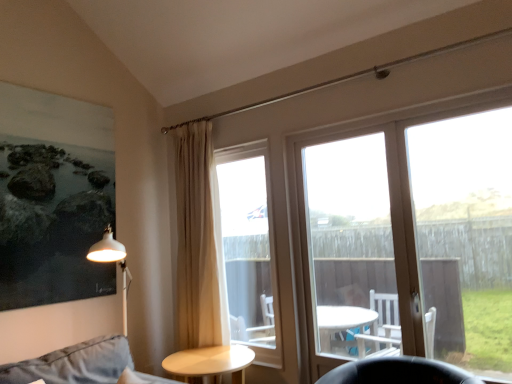
Identify the location of transparent glass door at upper right. Image resolution: width=512 pixels, height=384 pixels. (403, 226).

Locate an element on the screen. clear glass door at center is located at coordinates (250, 249).

The image size is (512, 384). What do you see at coordinates (210, 363) in the screenshot? I see `light beige wooden table at center` at bounding box center [210, 363].

In order to face light beige wooden table at center, should I rotate leftwards or rightwards?

Turn left approximately 6.243 degrees to face it.

The image size is (512, 384). Find the location of `beige fabric curtain at center`. beige fabric curtain at center is located at coordinates (198, 241).

Considering the relative sizes of white glass door at center and clear glass door at center right in the image provided, is white glass door at center thinner than clear glass door at center right?

Yes.

Between white glass door at center and clear glass door at center right, which one appears on the right side from the viewer's perspective?

clear glass door at center right.

From a real-world perspective, is white glass door at center below clear glass door at center right?

Correct, in the physical world, white glass door at center is lower than clear glass door at center right.

Is beige fabric curtain at center a part of clear glass door at center?

No, beige fabric curtain at center is located outside of clear glass door at center.

Would you consider clear glass door at center to be distant from beige fabric curtain at center?

clear glass door at center is near beige fabric curtain at center, not far away.

Visually, is clear glass door at center positioned to the left or to the right of beige fabric curtain at center?

Based on their positions, clear glass door at center is located to the right of beige fabric curtain at center.

Considering the positions of point (261, 220) and point (177, 134), is point (261, 220) closer or farther from the camera than point (177, 134)?

Clearly, point (261, 220) is more distant from the camera than point (177, 134).

Would you consider beige fabric curtain at center to be distant from white glass door at center?

beige fabric curtain at center is actually quite close to white glass door at center.

Between beige fabric curtain at center and white glass door at center, which one is positioned in front?

Positioned in front is white glass door at center.

Is beige fabric curtain at center aimed at white glass door at center?

No, beige fabric curtain at center is not oriented towards white glass door at center.

Is light beige wooden table at center turned away from beige fabric curtain at center?

No, light beige wooden table at center is not facing away from beige fabric curtain at center.

The image size is (512, 384). What are the coordinates of `table on the right of beige fabric curtain at center` in the screenshot? It's located at (210, 363).

Are light beige wooden table at center and beige fabric curtain at center making contact?

No.

How different are the orientations of light beige wooden table at center and clear glass door at center in degrees?

light beige wooden table at center and clear glass door at center are facing 91.7 degrees away from each other.

Which is nearer, (x=201, y=372) or (x=247, y=328)?

The point (x=201, y=372) is in front.

Would you say light beige wooden table at center is a long distance from clear glass door at center?

No, light beige wooden table at center is not far from clear glass door at center.

Can you tell me how much clear glass door at center right and clear glass door at center differ in facing direction?

0.000288 degrees separate the facing orientations of clear glass door at center right and clear glass door at center.

From a real-world perspective, is clear glass door at center right physically below clear glass door at center?

No, from a real-world perspective, clear glass door at center right is not below clear glass door at center.

Is clear glass door at center right far away from clear glass door at center?

Absolutely, clear glass door at center right is distant from clear glass door at center.

Is clear glass door at center right at the right side of clear glass door at center?

Yes, clear glass door at center right is to the right of clear glass door at center.

Is white glass door at center spatially inside beige fabric curtain at center, or outside of it?

white glass door at center lies outside beige fabric curtain at center.

Consider the image. Considering the sizes of objects white glass door at center and beige fabric curtain at center in the image provided, who is smaller, white glass door at center or beige fabric curtain at center?

With smaller size is white glass door at center.

From the image's perspective, is white glass door at center located beneath beige fabric curtain at center?

Indeed, from the image's perspective, white glass door at center is shown beneath beige fabric curtain at center.

Considering the positions of objects white glass door at center and beige fabric curtain at center in the image provided, who is behind, white glass door at center or beige fabric curtain at center?

Positioned behind is beige fabric curtain at center.

Where is `screen door that is on the left side of clear glass door at center right`? This screenshot has height=384, width=512. screen door that is on the left side of clear glass door at center right is located at coordinates pos(356,250).

Where is `curtain above the clear glass door at center (from a real-world perspective)`? curtain above the clear glass door at center (from a real-world perspective) is located at coordinates (198, 241).

Based on their spatial positions, is clear glass door at center or light beige wooden table at center further from clear glass door at center right?

light beige wooden table at center is further to clear glass door at center right.

Considering their positions, is clear glass door at center positioned closer to white glass door at center than beige fabric curtain at center?

clear glass door at center lies closer to white glass door at center than the other object.

When comparing their distances from transparent glass door at upper right, does beige fabric curtain at center or clear glass door at center right seem closer?

clear glass door at center right is closer to transparent glass door at upper right.

From the picture: Considering their positions, is white glass door at center positioned further to beige fabric curtain at center than clear glass door at center?

Based on the image, white glass door at center appears to be further to beige fabric curtain at center.

When comparing their distances from transparent glass door at upper right, does light beige wooden table at center or clear glass door at center seem further?

light beige wooden table at center.

Estimate the real-world distances between objects in this image. Which object is further from clear glass door at center right, transparent glass door at upper right or light beige wooden table at center?

light beige wooden table at center is further to clear glass door at center right.

Consider the image. When comparing their distances from transparent glass door at upper right, does white glass door at center or clear glass door at center seem closer?

white glass door at center.

Estimate the real-world distances between objects in this image. Which object is further from beige fabric curtain at center, transparent glass door at upper right or clear glass door at center right?

clear glass door at center right is further to beige fabric curtain at center.

Find the location of a particular element. window between light beige wooden table at center and clear glass door at center right in the horizontal direction is located at coordinates (403, 226).

You are a GUI agent. You are given a task and a screenshot of the screen. Output one action in this format:
    pyautogui.click(x=<x>, y=<y>)
    Task: Click on the window located between white glass door at center and clear glass door at center right in the left-right direction
    Image resolution: width=512 pixels, height=384 pixels.
    Given the screenshot: What is the action you would take?
    pyautogui.click(x=403, y=226)

I want to click on table between beige fabric curtain at center and clear glass door at center right in the horizontal direction, so click(x=210, y=363).

Locate an element on the screen. screen door situated between beige fabric curtain at center and transparent glass door at upper right from left to right is located at coordinates (356, 250).